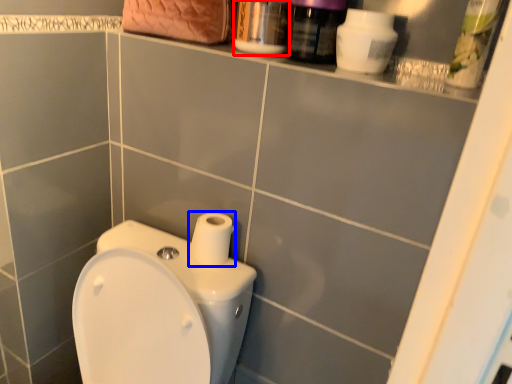
Question: Which of the following is the closest to the observer, mouthwash (highlighted by a red box) or toilet paper (highlighted by a blue box)?

Choices:
 (A) mouthwash
 (B) toilet paper

Answer: (A)